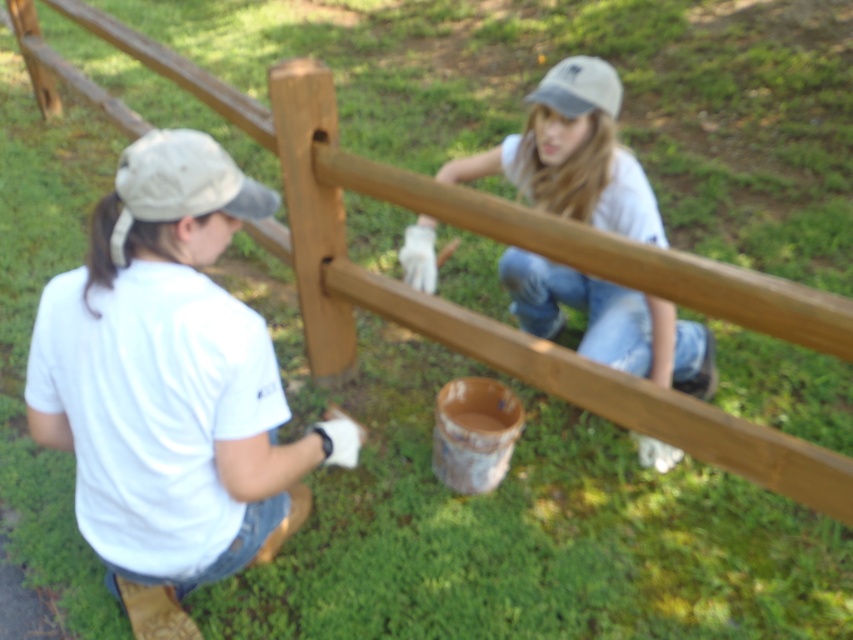
Question: Among these objects, which one is farthest from the camera?

Choices:
 (A) white fabric baseball cap at upper left
 (B) matte white shirt at center

Answer: (B)

Question: Which object is the farthest from the white fabric baseball cap at upper center?

Choices:
 (A) white matte shirt at left
 (B) matte white shirt at center
 (C) white fabric baseball cap at upper left

Answer: (A)

Question: Does matte white shirt at center have a smaller size compared to white fabric baseball cap at upper left?

Choices:
 (A) yes
 (B) no

Answer: (B)

Question: Is white matte shirt at left positioned behind white fabric baseball cap at upper center?

Choices:
 (A) no
 (B) yes

Answer: (A)

Question: Considering the real-world distances, which object is closest to the white fabric baseball cap at upper left?

Choices:
 (A) white fabric baseball cap at upper center
 (B) white matte shirt at left
 (C) matte white shirt at center

Answer: (B)

Question: Is white matte shirt at left bigger than white fabric baseball cap at upper center?

Choices:
 (A) no
 (B) yes

Answer: (B)